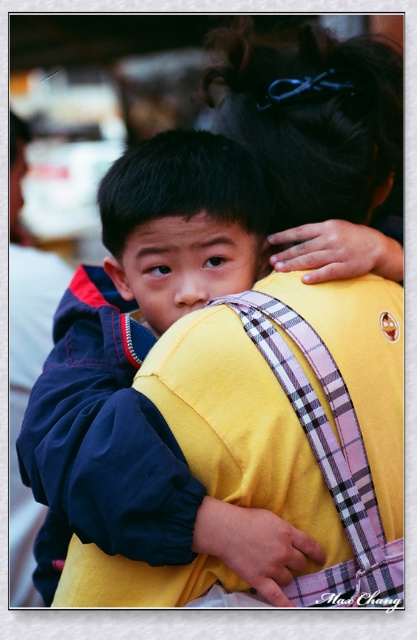
Question: Does dark blue fleece jacket at upper left have a lesser width compared to plaid fabric backpack at upper center?

Choices:
 (A) no
 (B) yes

Answer: (A)

Question: Observing the image, what is the correct spatial positioning of dark blue fleece jacket at upper left in reference to plaid fabric backpack at upper center?

Choices:
 (A) below
 (B) above

Answer: (A)

Question: Which point appears farthest from the camera in this image?

Choices:
 (A) (57, 385)
 (B) (304, 128)

Answer: (B)

Question: Can you confirm if dark blue fleece jacket at upper left is positioned below plaid fabric backpack at upper center?

Choices:
 (A) yes
 (B) no

Answer: (A)